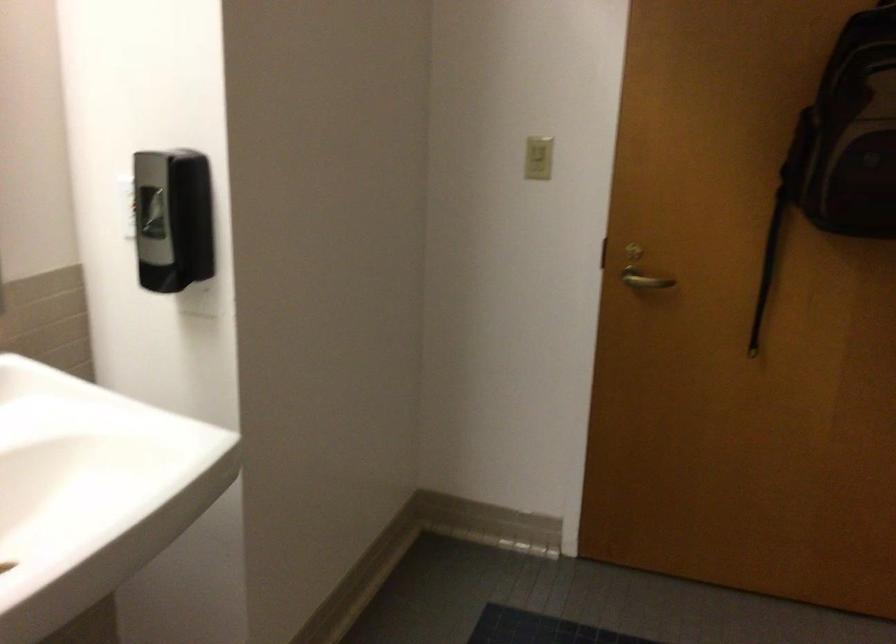
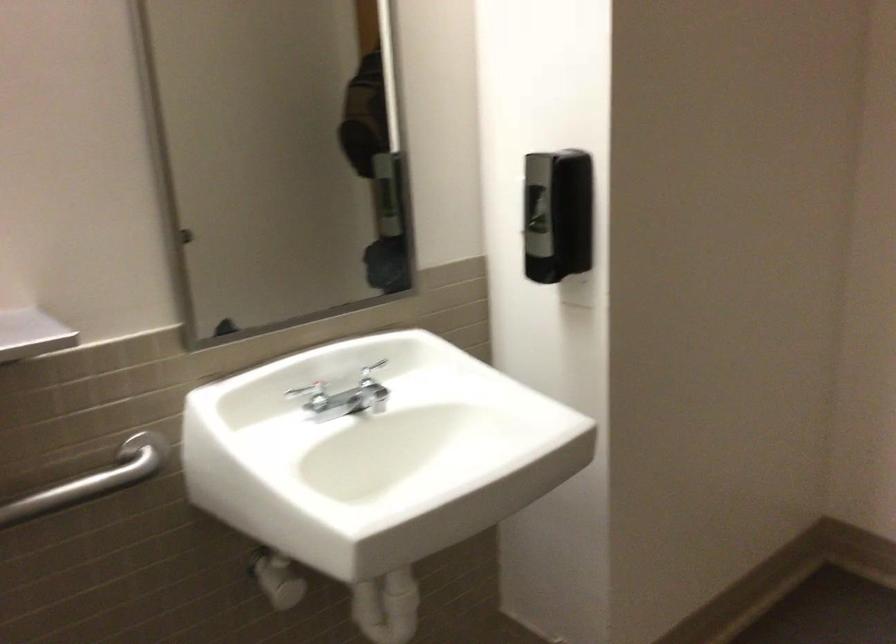
Find the pixel in the second image that matches point 151,214 in the first image.

(536, 207)